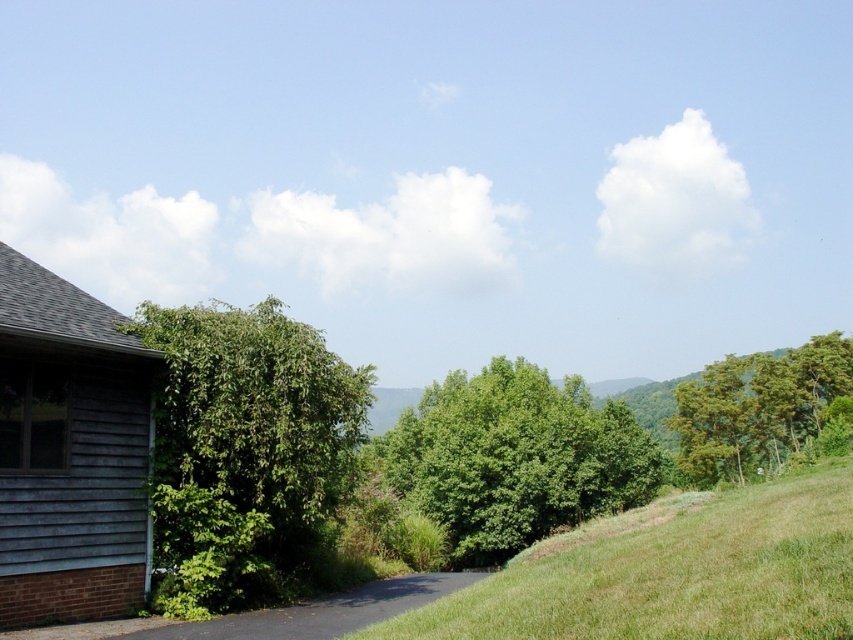
Question: Which object is positioned closest to the green leafy tree at center?

Choices:
 (A) green leafy tree at right
 (B) green leafy tree at lower left
 (C) green grassy hillside at lower right
 (D) black asphalt driveway at lower left

Answer: (A)

Question: Is green leafy tree at lower left below green leafy tree at center?

Choices:
 (A) yes
 (B) no

Answer: (B)

Question: Is green grassy hillside at lower right above green leafy tree at right?

Choices:
 (A) no
 (B) yes

Answer: (B)

Question: Which object is closer to the camera taking this photo?

Choices:
 (A) black asphalt driveway at lower left
 (B) green leafy tree at right

Answer: (A)

Question: Which object appears closest to the camera in this image?

Choices:
 (A) black asphalt driveway at lower left
 (B) green grassy hillside at lower right
 (C) green leafy tree at right
 (D) green leafy tree at lower left

Answer: (B)

Question: Is green grassy hillside at lower right in front of black asphalt driveway at lower left?

Choices:
 (A) no
 (B) yes

Answer: (B)